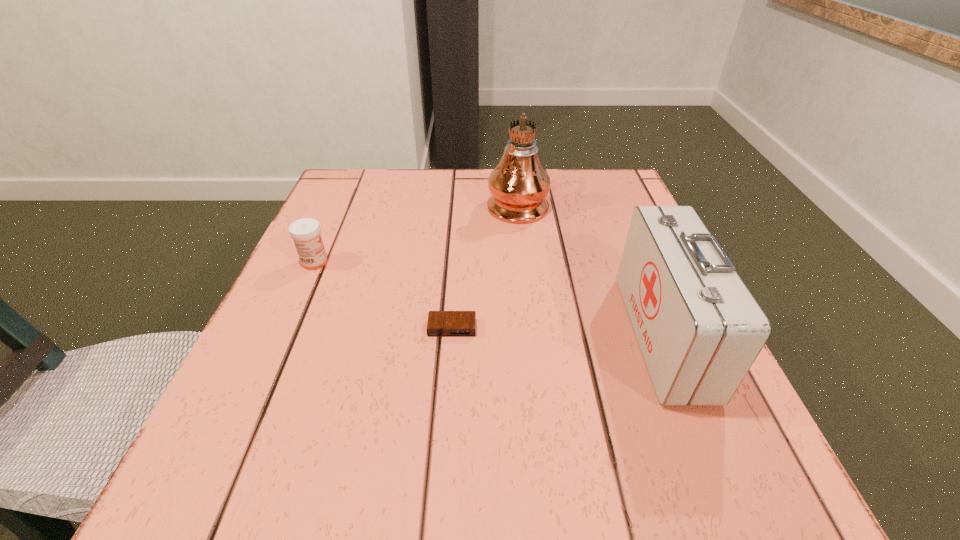
At what (x,y) coordinates should I click in order to perform the action: click on vacant space at the right edge of the desktop. Please return your answer as a coordinate pair (x, y). This screenshot has width=960, height=540. Looking at the image, I should click on (625, 232).

Image resolution: width=960 pixels, height=540 pixels. I want to click on vacant region at the far left corner of the desktop, so click(392, 205).

Locate an element on the screen. Image resolution: width=960 pixels, height=540 pixels. vacant space at the far right corner is located at coordinates (588, 212).

Identify the location of empty space that is in between the leftmost object and the alarm clock. (383, 295).

The height and width of the screenshot is (540, 960). I want to click on free space between the medicine and the second tallest object, so click(x=489, y=299).

Where is `vacant point located between the third object from left to right and the leftmost object`? This screenshot has width=960, height=540. vacant point located between the third object from left to right and the leftmost object is located at coordinates (416, 233).

Locate an element on the screen. unoccupied area between the farthest object and the rightmost object is located at coordinates (590, 269).

At what (x,y) coordinates should I click in order to perform the action: click on blank region between the third nearest object and the rightmost object. Please return your answer as a coordinate pair (x, y). This screenshot has width=960, height=540. Looking at the image, I should click on (489, 299).

You are a GUI agent. You are given a task and a screenshot of the screen. Output one action in this format:
    pyautogui.click(x=<x>, y=<y>)
    Task: Click on the free point between the rightmost object and the third object from right to left
    This screenshot has height=540, width=960.
    Given the screenshot: What is the action you would take?
    pyautogui.click(x=558, y=332)

You are a GUI agent. You are given a task and a screenshot of the screen. Output one action in this format:
    pyautogui.click(x=<x>, y=<y>)
    Task: Click on the empty space between the tallest object and the first-aid kit
    
    Given the screenshot: What is the action you would take?
    pyautogui.click(x=590, y=269)